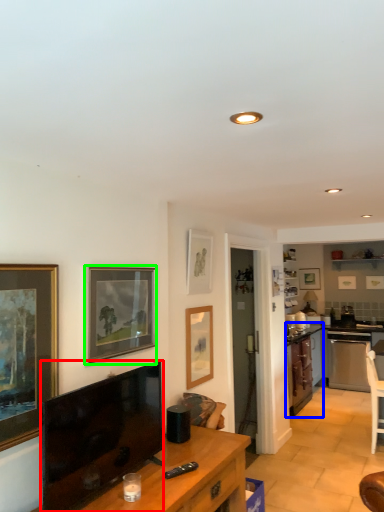
Question: Which object is the closest to the television (highlighted by a red box)? Choose among these: cabinetry (highlighted by a blue box) or picture frame (highlighted by a green box).

Choices:
 (A) cabinetry
 (B) picture frame

Answer: (B)